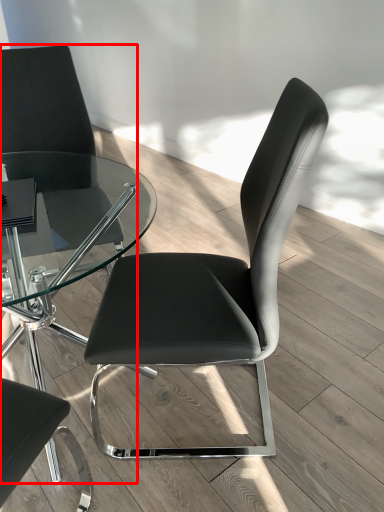
Question: From the image's perspective, where is chair (annotated by the red box) located in relation to chair in the image?

Choices:
 (A) above
 (B) below

Answer: (A)